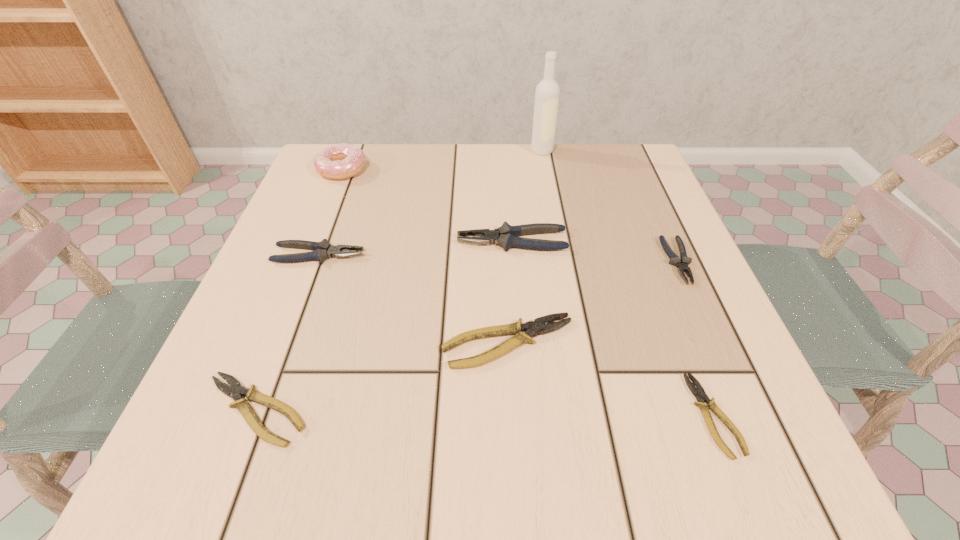
This screenshot has height=540, width=960. Find the location of `free space between the smallest gray pliers and the farthest object`. free space between the smallest gray pliers and the farthest object is located at coordinates (610, 206).

This screenshot has height=540, width=960. Find the location of `vacant space in between the second smallest gray pliers and the second gray pliers from right to left`. vacant space in between the second smallest gray pliers and the second gray pliers from right to left is located at coordinates pyautogui.click(x=416, y=248).

Identify the location of vacant point located between the smallest gray pliers and the pink doughnut. The image size is (960, 540). tap(510, 215).

Identify the location of unoccupied position between the doughnut and the farthest object. (442, 160).

What are the coordinates of `vacant area that lies between the vodka and the smallest yellow pliers` in the screenshot? It's located at (628, 283).

Locate an element on the screen. This screenshot has height=540, width=960. object that stands as the fourth closest to the fifth tallest pliers is located at coordinates (340, 161).

At what (x,y) coordinates should I click in order to perform the action: click on object that is the seventh nearest to the shortest pliers. Please return your answer as a coordinate pair (x, y). This screenshot has height=540, width=960. Looking at the image, I should click on (340, 161).

Point out which pliers is positioned as the sixth nearest to the doughnut. Please provide its 2D coordinates. Your answer should be formatted as a tuple, i.e. [(x, y)], where the tuple contains the x and y coordinates of a point satisfying the conditions above.

[(699, 393)]

Find the location of a particular element. Image resolution: width=960 pixels, height=540 pixels. pliers that is the second closest one to the farthest yellow pliers is located at coordinates (505, 236).

Locate which gray pliers is the second closest to the vodka. Please provide its 2D coordinates. Your answer should be formatted as a tuple, i.e. [(x, y)], where the tuple contains the x and y coordinates of a point satisfying the conditions above.

[(682, 263)]